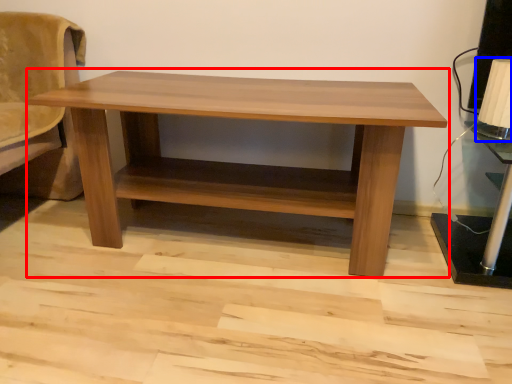
Question: Which object appears closest to the camera in this image, table (highlighted by a red box) or table lamp (highlighted by a blue box)?

Choices:
 (A) table
 (B) table lamp

Answer: (A)